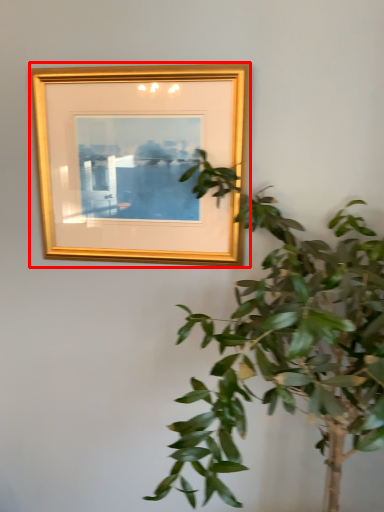
Question: From the image's perspective, what is the correct spatial relationship of picture frame (annotated by the red box) in relation to houseplant?

Choices:
 (A) below
 (B) above

Answer: (B)